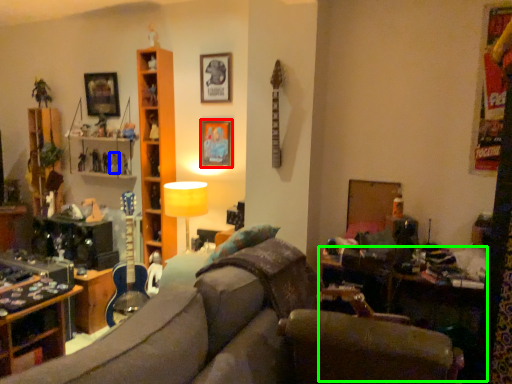
Question: Which is nearer to the picture frame (highlighted by a red box)? toy (highlighted by a blue box) or table (highlighted by a green box).

Choices:
 (A) toy
 (B) table

Answer: (A)